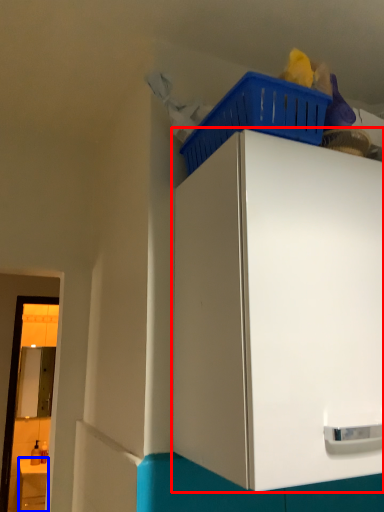
Question: Which object appears farthest to the camera in this image, cabinetry (highlighted by a red box) or counter (highlighted by a blue box)?

Choices:
 (A) cabinetry
 (B) counter

Answer: (B)